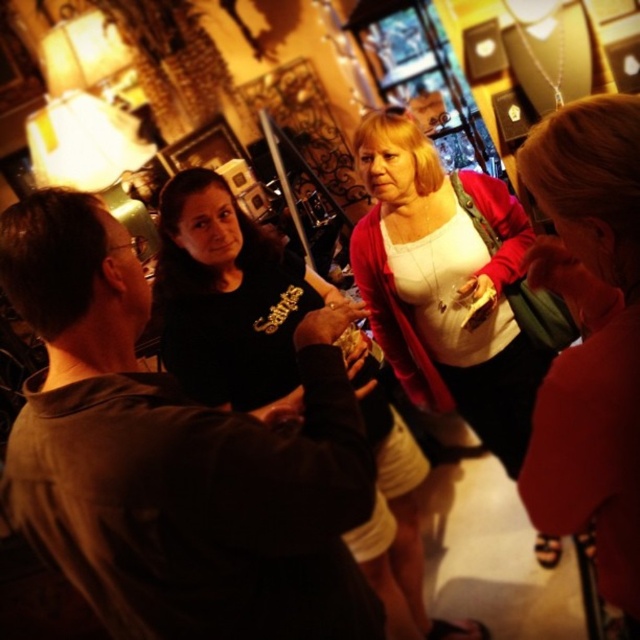
Can you confirm if matte red shirt at center is wider than black matte shirt at center?

No.

Which of these two, matte red shirt at center or black matte shirt at center, stands taller?

Standing taller between the two is matte red shirt at center.

Does point (532, 177) come closer to viewer compared to point (170, 241)?

Yes, point (532, 177) is in front of point (170, 241).

Locate an element on the screen. This screenshot has height=640, width=640. matte red shirt at center is located at coordinates coord(589,337).

Does dark brown leather jacket at center lie behind black matte shirt at center?

No, dark brown leather jacket at center is in front of black matte shirt at center.

Where is `dark brown leather jacket at center`? This screenshot has height=640, width=640. dark brown leather jacket at center is located at coordinates (176, 458).

Is point (212, 468) more distant than point (184, 289)?

No, (212, 468) is closer to viewer.

You are a GUI agent. You are given a task and a screenshot of the screen. Output one action in this format:
    pyautogui.click(x=<x>, y=<y>)
    Task: Click on the dark brown leather jacket at center
    
    Given the screenshot: What is the action you would take?
    pyautogui.click(x=176, y=458)

Does dark brown leather jacket at center appear on the right side of matte red shirt at center?

Incorrect, dark brown leather jacket at center is not on the right side of matte red shirt at center.

Locate an element on the screen. This screenshot has height=640, width=640. dark brown leather jacket at center is located at coordinates (176, 458).

Identify the location of dark brown leather jacket at center. (176, 458).